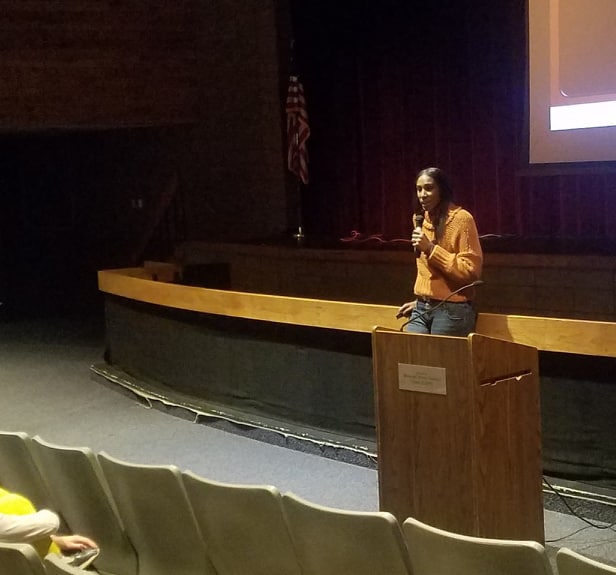
This screenshot has width=616, height=575. I want to click on projector screen, so click(586, 48).